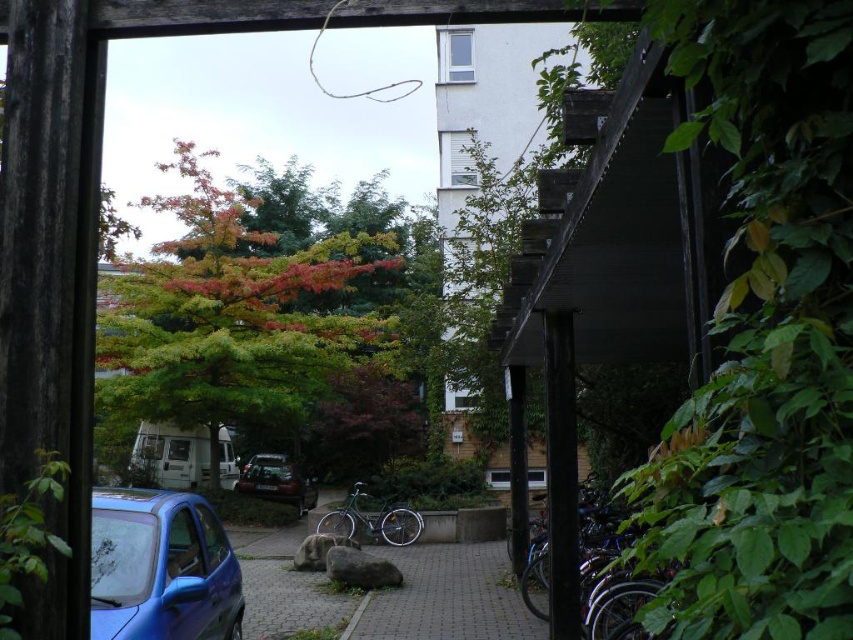
You are a painter setting up your easel to paint the scene. You want to focus on the multicolored foliage at center and the shiny metallic bicycle at center. Which object should you move closer to if you want to include both in your painting without cropping either?

The multicolored foliage at center has a larger width than the shiny metallic bicycle at center, so you should move closer to the multicolored foliage at center to ensure both fit within your painting frame.

You are a delivery person trying to park your shiny metallic bicycle at lower right near the brick paved driveway at center. Based on the scene, can you estimate if there is enough space between them for you to comfortably maneuver your bicycle into position?

The distance between the brick paved driveway at center and the shiny metallic bicycle at lower right is 3.32 feet. This distance is sufficient for a delivery person to comfortably maneuver the bicycle into position, as most bicycles require about 2 to 3 feet of space for turning and positioning.

From the picture: You are a painter setting up an easel to paint the scene. You want to focus on the multicolored foliage at center and the shiny metallic bicycle at center. Which object should you stand closer to in order to paint both in detail?

The multicolored foliage at center is much taller than the shiny metallic bicycle at center, so you should stand closer to the shiny metallic bicycle at center to ensure both objects appear proportionate in size on your painting.